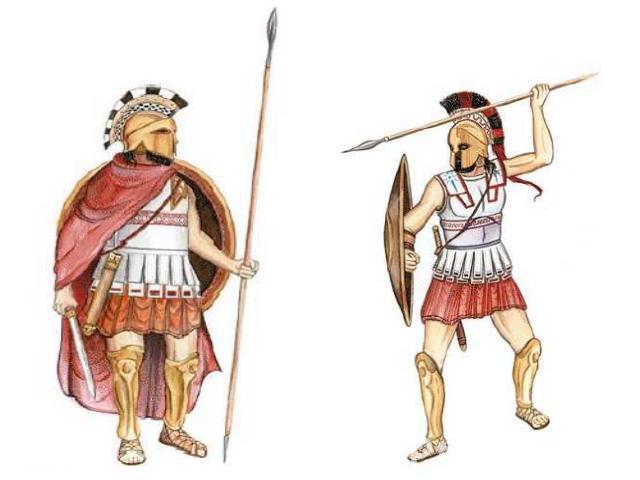
In order to click on artwork in this screenshot , I will do `click(459, 248)`.